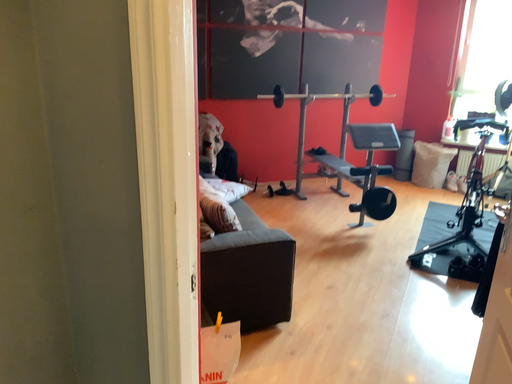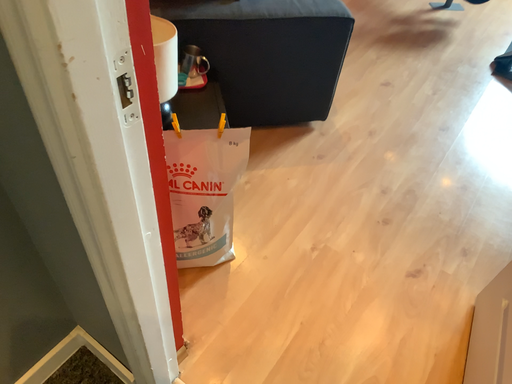
Question: How did the camera likely rotate when shooting the video?

Choices:
 (A) rotated right
 (B) rotated left

Answer: (B)